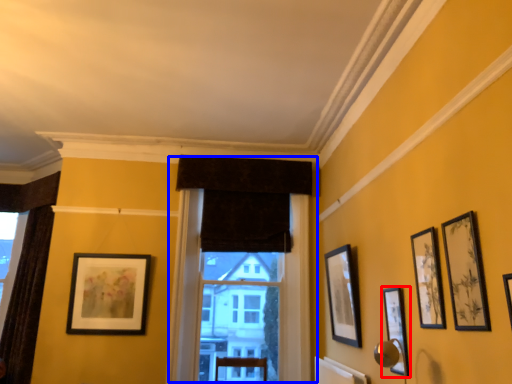
Question: Which object is closer to the camera taking this photo, picture frame (highlighted by a red box) or window (highlighted by a blue box)?

Choices:
 (A) picture frame
 (B) window

Answer: (A)